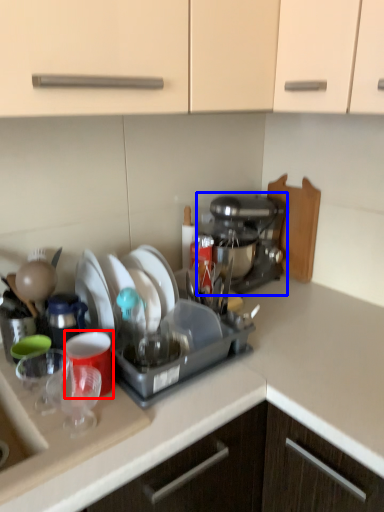
Question: Which point is further to the camera, coffee cup (highlighted by a red box) or coffee maker (highlighted by a blue box)?

Choices:
 (A) coffee cup
 (B) coffee maker

Answer: (B)